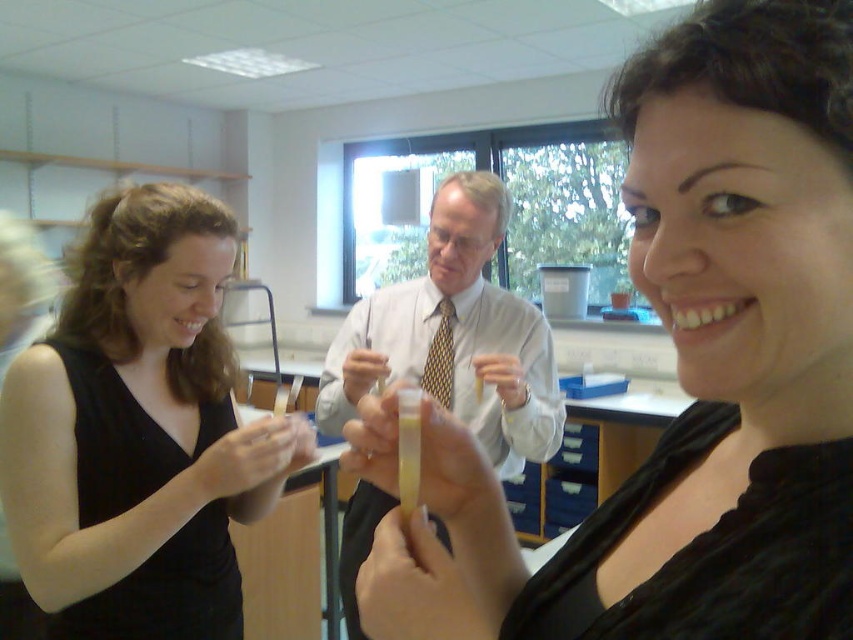
Question: Which point is farther to the camera?

Choices:
 (A) black matte dress at left
 (B) white shirt at center

Answer: (B)

Question: Is black matte/soft shirt at center positioned before black matte dress at left?

Choices:
 (A) no
 (B) yes

Answer: (B)

Question: Estimate the real-world distances between objects in this image. Which object is closer to the white shirt at center?

Choices:
 (A) black matte/soft shirt at center
 (B) black matte dress at left

Answer: (B)

Question: Which point is farther to the camera?

Choices:
 (A) (39, 586)
 (B) (392, 499)

Answer: (B)

Question: Is black matte/soft shirt at center above white shirt at center?

Choices:
 (A) yes
 (B) no

Answer: (A)

Question: Is black matte dress at left above white shirt at center?

Choices:
 (A) yes
 (B) no

Answer: (A)